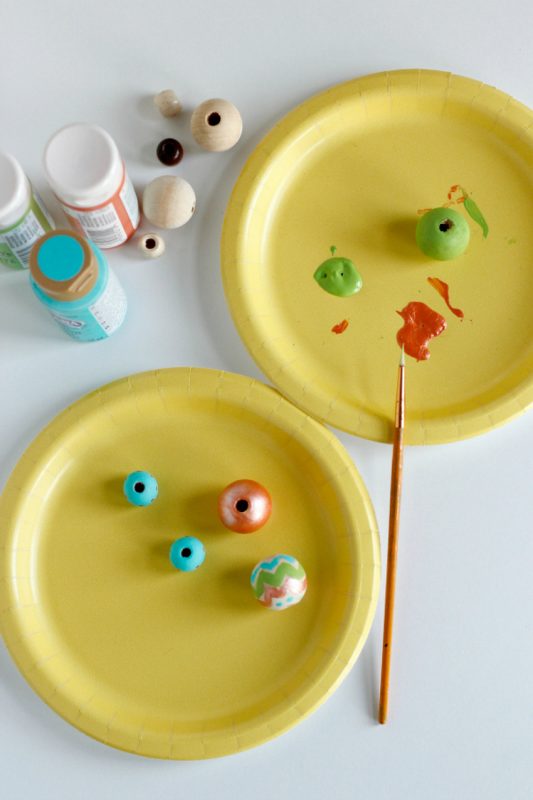
This screenshot has height=800, width=533. In order to click on white table in this screenshot , I will do `click(461, 742)`, `click(90, 358)`.